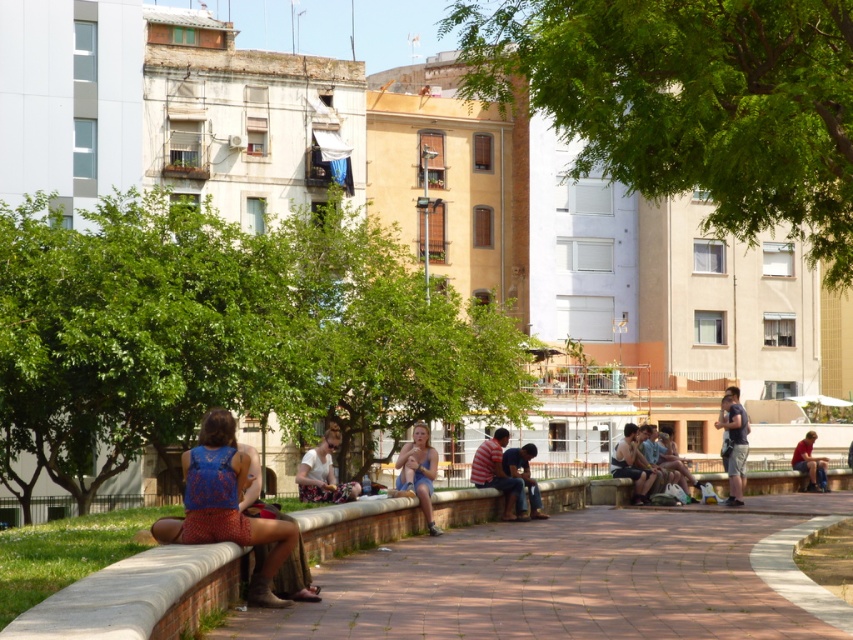
Question: Which point is farther to the camera?

Choices:
 (A) denim shorts at lower right
 (B) striped cotton shirt at center
 (C) green leafy tree at center

Answer: (A)

Question: Among these points, which one is nearest to the camera?

Choices:
 (A) pos(257,317)
 (B) pos(329,440)
 (C) pos(734,468)

Answer: (B)

Question: Is light blue denim shorts at center behind dark blue t-shirt at center?

Choices:
 (A) yes
 (B) no

Answer: (B)

Question: Is brick paved path at lower center closer to the viewer compared to floral fabric dress at center?

Choices:
 (A) no
 (B) yes

Answer: (B)

Question: Among these points, which one is nearest to the camera?

Choices:
 (A) (525, 486)
 (B) (323, 461)
 (C) (801, 490)
 (D) (90, 468)

Answer: (B)

Question: Does blue printed dress at center appear on the right side of dark blue t-shirt at center?

Choices:
 (A) no
 (B) yes

Answer: (A)